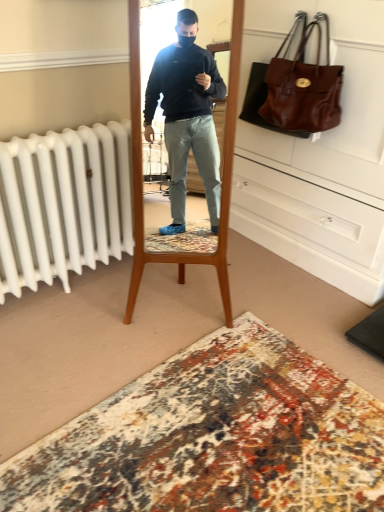
Question: Does matte brown leather dresser at upper right have a lesser height compared to brown leather handbag at upper right?

Choices:
 (A) no
 (B) yes

Answer: (A)

Question: Considering the relative positions of matte brown leather dresser at upper right and brown leather handbag at upper right in the image provided, is matte brown leather dresser at upper right to the left of brown leather handbag at upper right from the viewer's perspective?

Choices:
 (A) yes
 (B) no

Answer: (B)

Question: Can you see matte brown leather dresser at upper right touching brown leather handbag at upper right?

Choices:
 (A) no
 (B) yes

Answer: (A)

Question: Is matte brown leather dresser at upper right further to camera compared to brown leather handbag at upper right?

Choices:
 (A) yes
 (B) no

Answer: (B)

Question: Would you say matte brown leather dresser at upper right is outside brown leather handbag at upper right?

Choices:
 (A) no
 (B) yes

Answer: (B)

Question: Considering the relative positions of carpet with intricate patterns at lower center and matte brown leather dresser at upper right in the image provided, is carpet with intricate patterns at lower center to the left or to the right of matte brown leather dresser at upper right?

Choices:
 (A) left
 (B) right

Answer: (A)

Question: Which is correct: carpet with intricate patterns at lower center is inside matte brown leather dresser at upper right, or outside of it?

Choices:
 (A) outside
 (B) inside

Answer: (A)

Question: Considering the positions of carpet with intricate patterns at lower center and matte brown leather dresser at upper right in the image, is carpet with intricate patterns at lower center taller or shorter than matte brown leather dresser at upper right?

Choices:
 (A) tall
 (B) short

Answer: (B)

Question: From the image's perspective, is carpet with intricate patterns at lower center located above or below matte brown leather dresser at upper right?

Choices:
 (A) above
 (B) below

Answer: (B)

Question: Choose the correct answer: Is matte brown leather dresser at upper right inside brown leather handbag at upper right or outside it?

Choices:
 (A) outside
 (B) inside

Answer: (A)

Question: From their relative heights in the image, would you say matte brown leather dresser at upper right is taller or shorter than brown leather handbag at upper right?

Choices:
 (A) tall
 (B) short

Answer: (A)

Question: From a real-world perspective, is matte brown leather dresser at upper right positioned above or below brown leather handbag at upper right?

Choices:
 (A) below
 (B) above

Answer: (A)

Question: Looking at their shapes, would you say matte brown leather dresser at upper right is wider or thinner than brown leather handbag at upper right?

Choices:
 (A) thin
 (B) wide

Answer: (B)

Question: Is point (316, 128) closer or farther from the camera than point (294, 206)?

Choices:
 (A) closer
 (B) farther

Answer: (A)

Question: Is brown leather handbag at upper right spatially inside matte brown leather dresser at upper right, or outside of it?

Choices:
 (A) inside
 (B) outside

Answer: (A)